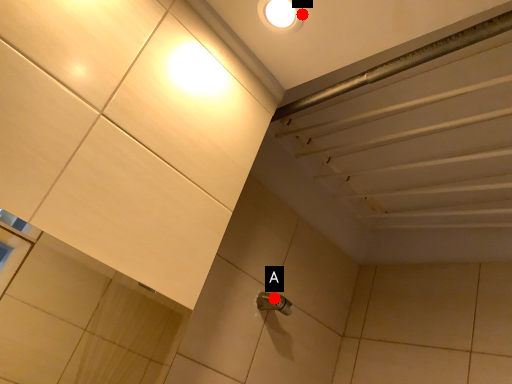
Question: Two points are circled on the image, labeled by A and B beside each circle. Which point appears closest to the camera in this image?

Choices:
 (A) A is closer
 (B) B is closer

Answer: (B)